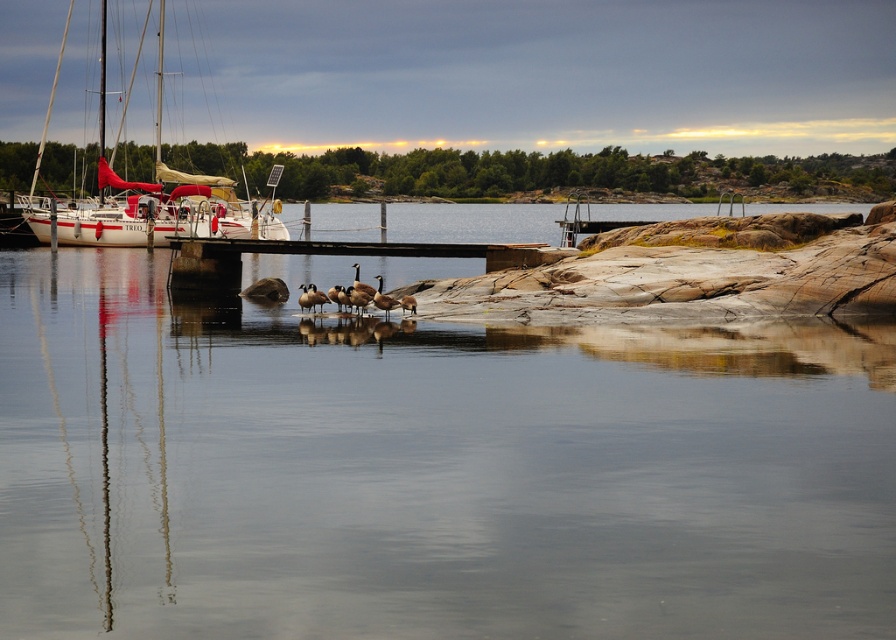
Question: Which of the following is the closest to the observer?

Choices:
 (A) brown wooden dock at center
 (B) clear water at center

Answer: (B)

Question: Which point is farther from the camera taking this photo?

Choices:
 (A) (157, 243)
 (B) (817, 612)
 (C) (200, 280)

Answer: (A)

Question: Does clear water at center appear on the left side of brown wooden dock at center?

Choices:
 (A) yes
 (B) no

Answer: (A)

Question: Is clear water at center below white matte sailboat at left?

Choices:
 (A) yes
 (B) no

Answer: (A)

Question: Can you confirm if clear water at center is bigger than brown wooden dock at center?

Choices:
 (A) yes
 (B) no

Answer: (A)

Question: Which object is farther from the camera taking this photo?

Choices:
 (A) white matte sailboat at left
 (B) clear water at center

Answer: (A)